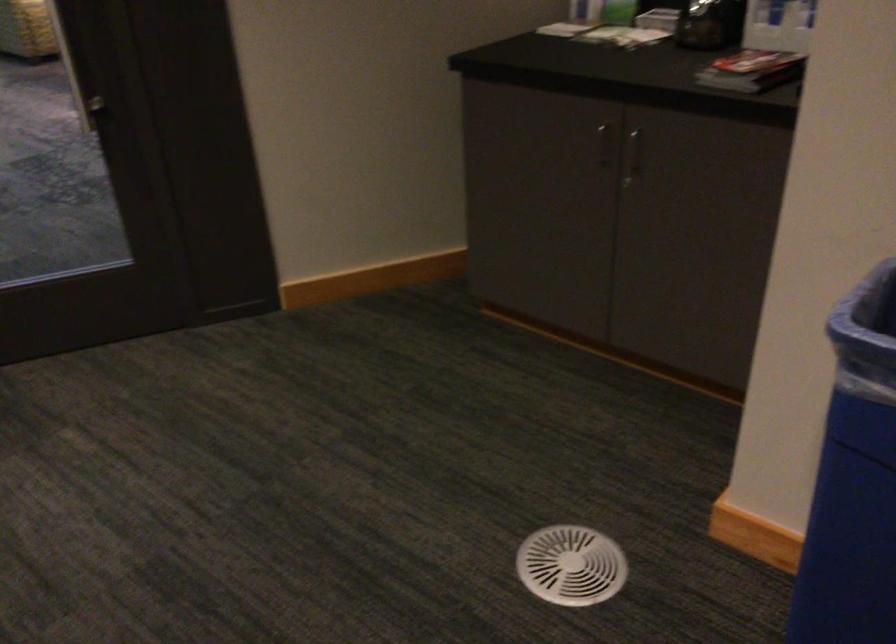
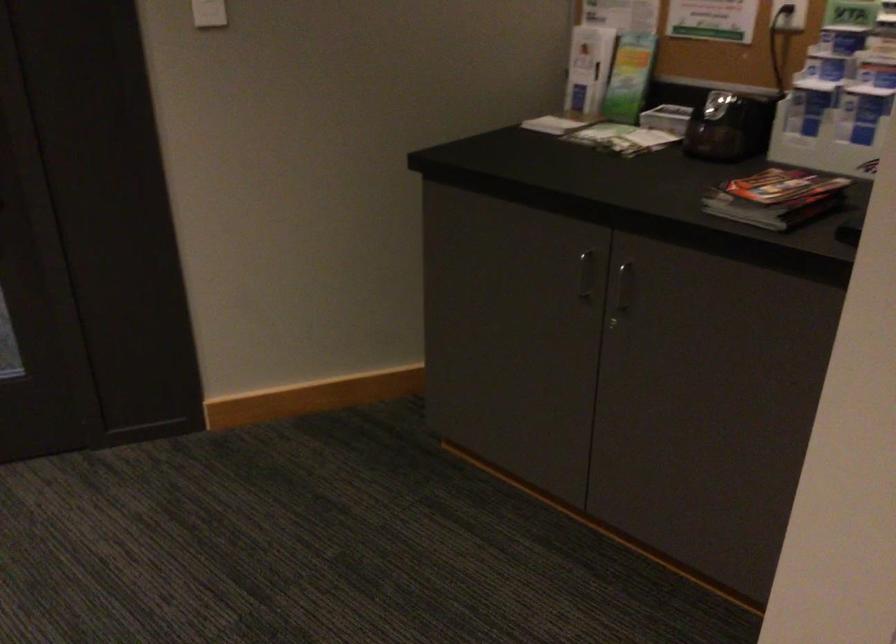
Where in the second image is the point corresponding to point (601, 142) from the first image?

(584, 275)